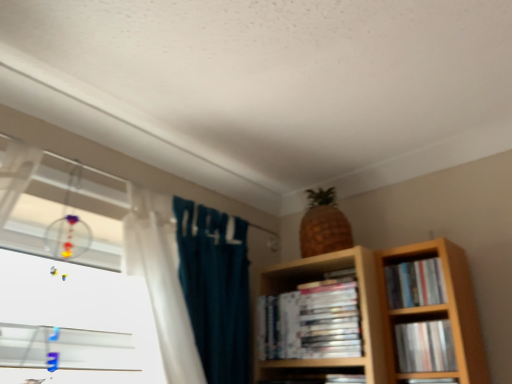
Question: Considering the relative positions of matte plastic books at center, the first book viewed from the left, and matte plastic book at lower right, arranged as the 3th book when viewed from the left, in the image provided, is matte plastic books at center, the first book viewed from the left, in front of matte plastic book at lower right, arranged as the 3th book when viewed from the left,?

Choices:
 (A) yes
 (B) no

Answer: (B)

Question: Is matte plastic books at center, which is the 4th book from right to left, behind matte plastic book at lower right, arranged as the 3th book when viewed from the left?

Choices:
 (A) yes
 (B) no

Answer: (A)

Question: From the image's perspective, would you say matte plastic books at center, the first book viewed from the left, is positioned over matte plastic book at lower right, which is the second book in right-to-left order?

Choices:
 (A) yes
 (B) no

Answer: (A)

Question: Is there a large distance between matte plastic books at center, the first book viewed from the left, and matte plastic book at lower right, arranged as the 3th book when viewed from the left?

Choices:
 (A) no
 (B) yes

Answer: (A)

Question: From a real-world perspective, does matte plastic books at center, the first book viewed from the left, sit lower than matte plastic book at lower right, arranged as the 3th book when viewed from the left?

Choices:
 (A) yes
 (B) no

Answer: (B)

Question: Which is correct: matte plastic book at lower right, which is the second book in right-to-left order, is inside matte plastic books at right, which appears as the fourth book when viewed from the left, or outside of it?

Choices:
 (A) outside
 (B) inside

Answer: (A)

Question: From the image's perspective, relative to matte plastic books at right, the first book in the right-to-left sequence, is matte plastic book at lower right, arranged as the 3th book when viewed from the left, above or below?

Choices:
 (A) above
 (B) below

Answer: (B)

Question: Is matte plastic book at lower right, which is the second book in right-to-left order, to the left or to the right of matte plastic books at right, the first book in the right-to-left sequence, in the image?

Choices:
 (A) right
 (B) left

Answer: (B)

Question: From their relative heights in the image, would you say matte plastic book at lower right, which is the second book in right-to-left order, is taller or shorter than matte plastic books at right, which appears as the fourth book when viewed from the left?

Choices:
 (A) tall
 (B) short

Answer: (A)

Question: From the image's perspective, is matte black book at lower right, the 2th book from the left, located above or below matte plastic book at lower right, which is the second book in right-to-left order?

Choices:
 (A) below
 (B) above

Answer: (A)

Question: Is point (452, 379) closer or farther from the camera than point (401, 354)?

Choices:
 (A) farther
 (B) closer

Answer: (B)

Question: In the image, is matte black book at lower right, the 2th book from the left, positioned in front of or behind matte plastic book at lower right, which is the second book in right-to-left order?

Choices:
 (A) behind
 (B) front

Answer: (B)

Question: Is matte black book at lower right, which appears as the third book when viewed from the right, inside or outside of matte plastic book at lower right, which is the second book in right-to-left order?

Choices:
 (A) inside
 (B) outside

Answer: (B)

Question: From the image's perspective, is matte plastic book at lower right, which is the second book in right-to-left order, positioned above or below matte plastic books at center, the first book viewed from the left?

Choices:
 (A) below
 (B) above

Answer: (A)

Question: In terms of size, does matte plastic book at lower right, arranged as the 3th book when viewed from the left, appear bigger or smaller than matte plastic books at center, which is the 4th book from right to left?

Choices:
 (A) small
 (B) big

Answer: (A)